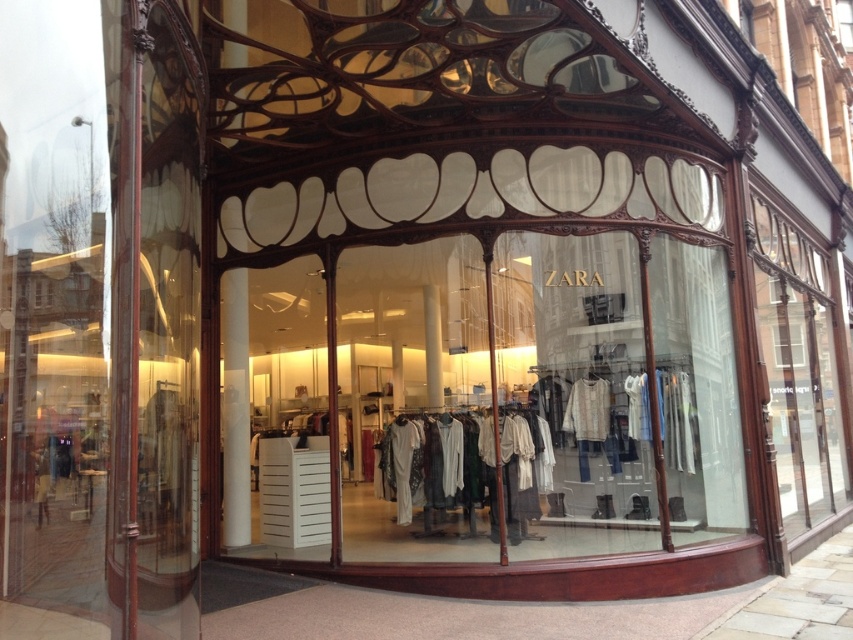
Does point (637, 179) lie in front of point (784, 262)?

Yes, it is.

Is wooden frame at center to the left of clear glass window at upper right from the viewer's perspective?

Yes, wooden frame at center is to the left of clear glass window at upper right.

Locate an element on the screen. The height and width of the screenshot is (640, 853). wooden frame at center is located at coordinates point(531,362).

Locate an element on the screen. This screenshot has width=853, height=640. wooden frame at center is located at coordinates (531, 362).

Can you confirm if wooden frame at center is bigger than white cotton shirts at center?

Correct, wooden frame at center is larger in size than white cotton shirts at center.

Does point (444, 244) lie behind point (410, 440)?

Yes, point (444, 244) is behind point (410, 440).

You are a GUI agent. You are given a task and a screenshot of the screen. Output one action in this format:
    pyautogui.click(x=<x>, y=<y>)
    Task: Click on the wooden frame at center
    The height and width of the screenshot is (640, 853).
    Given the screenshot: What is the action you would take?
    pyautogui.click(x=531, y=362)

Consider the image. How distant is clear glass window at upper right from white cotton shirts at center?

14.00 feet

Which is more to the left, clear glass window at upper right or white cotton shirts at center?

From the viewer's perspective, white cotton shirts at center appears more on the left side.

I want to click on clear glass window at upper right, so click(798, 371).